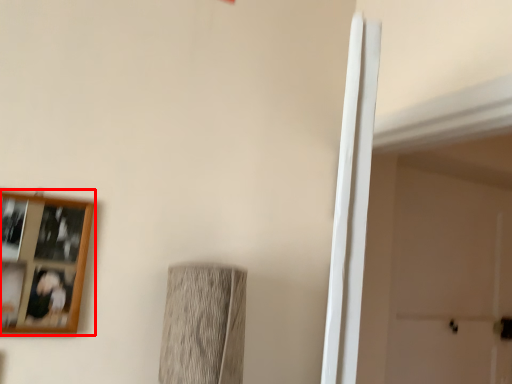
Question: From the image's perspective, where is picture frame (annotated by the red box) located in relation to door in the image?

Choices:
 (A) below
 (B) above

Answer: (B)